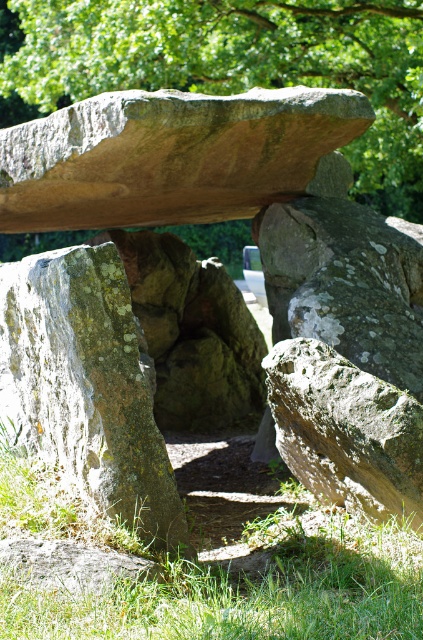
In the scene shown: Which of these two, green grass at lower center or lichen-covered rock at left, stands shorter?

green grass at lower center

Can you confirm if green grass at lower center is bigger than lichen-covered rock at left?

Indeed, green grass at lower center has a larger size compared to lichen-covered rock at left.

Who is more forward, (131, 600) or (27, 381)?

Point (131, 600) is in front.

Find the location of a particular element. The height and width of the screenshot is (640, 423). green grass at lower center is located at coordinates (242, 570).

Describe the element at coordinates (236, 64) in the screenshot. I see `green leafy tree at upper center` at that location.

Can you confirm if green leafy tree at upper center is shorter than lichen-covered rock at left?

Correct, green leafy tree at upper center is not as tall as lichen-covered rock at left.

Locate an element on the screen. This screenshot has width=423, height=640. green leafy tree at upper center is located at coordinates (236, 64).

Is green grass at lower center thinner than green leafy tree at upper center?

Incorrect, green grass at lower center's width is not less than green leafy tree at upper center's.

Based on the photo, does green grass at lower center lie behind green leafy tree at upper center?

No, green grass at lower center is closer to the viewer.

Locate an element on the screen. green grass at lower center is located at coordinates (242, 570).